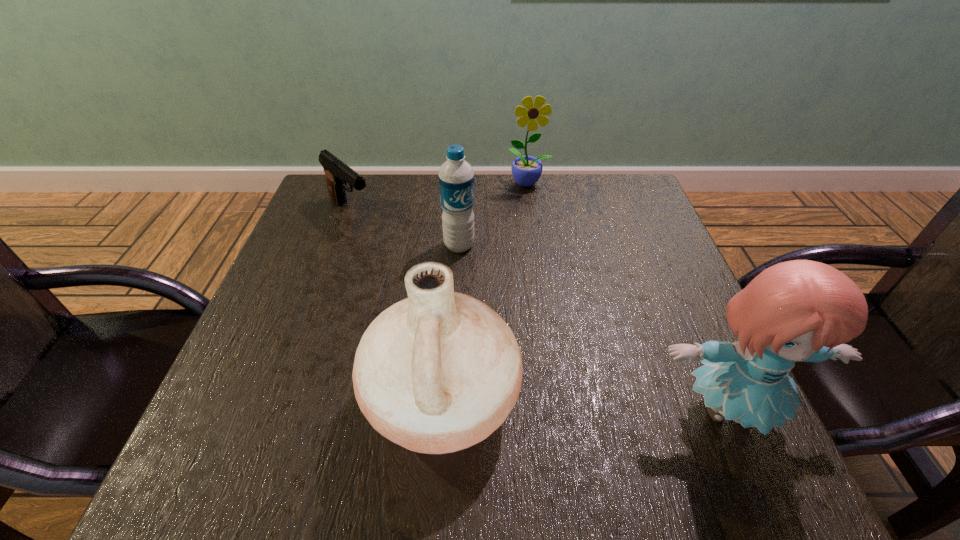
Locate an element on the screen. The height and width of the screenshot is (540, 960). sunflower located in the far edge section of the desktop is located at coordinates (526, 170).

Image resolution: width=960 pixels, height=540 pixels. Identify the location of pottery located at the near edge. tap(437, 372).

Find the location of a particular element. This screenshot has width=960, height=540. doll located at the near edge is located at coordinates (796, 311).

The image size is (960, 540). Find the location of `object located in the left edge section of the desktop`. object located in the left edge section of the desktop is located at coordinates (337, 173).

This screenshot has height=540, width=960. Identify the location of object positioned at the right edge. (796, 311).

The width and height of the screenshot is (960, 540). I want to click on object that is at the far left corner, so click(x=337, y=173).

Locate an element on the screen. This screenshot has height=540, width=960. object that is at the near right corner is located at coordinates (796, 311).

Identify the location of free space at the far edge. Image resolution: width=960 pixels, height=540 pixels. (502, 219).

I want to click on vacant space at the near edge of the desktop, so click(353, 421).

In the image, there is a desktop. At what (x,y) coordinates should I click in order to perform the action: click on vacant space at the left edge. Please return your answer as a coordinate pair (x, y). Image resolution: width=960 pixels, height=540 pixels. Looking at the image, I should click on (297, 234).